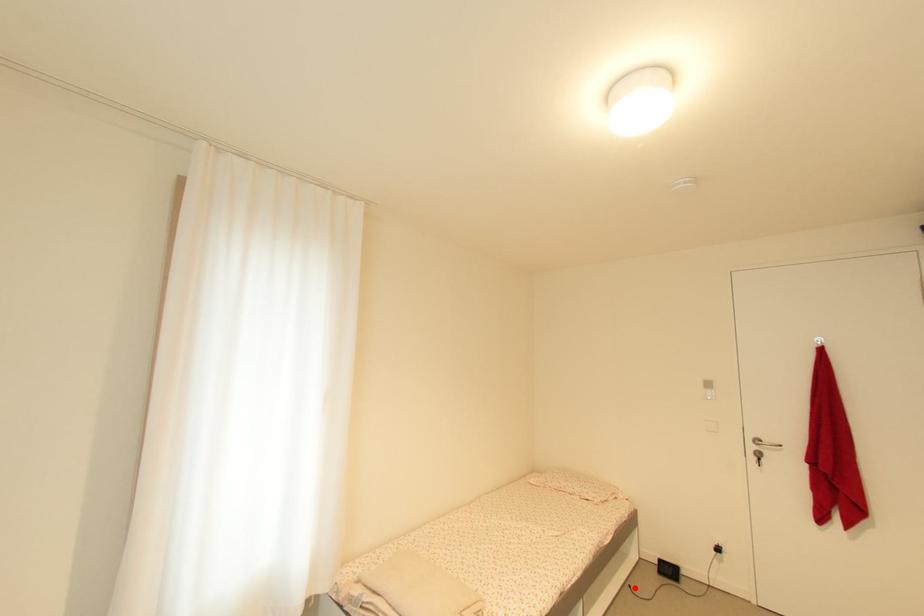
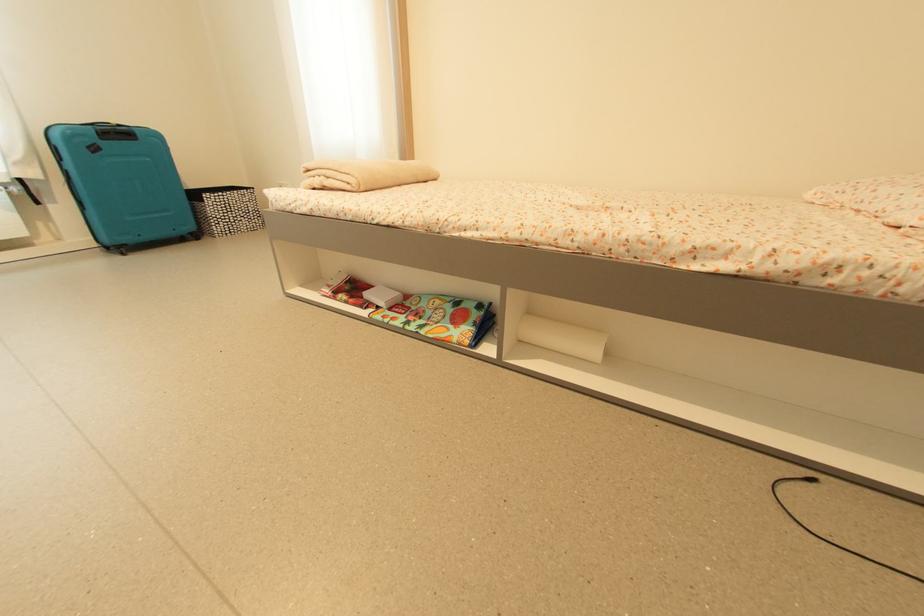
Where in the second image is the point corresponding to the highlighted location from the first image?

(817, 483)